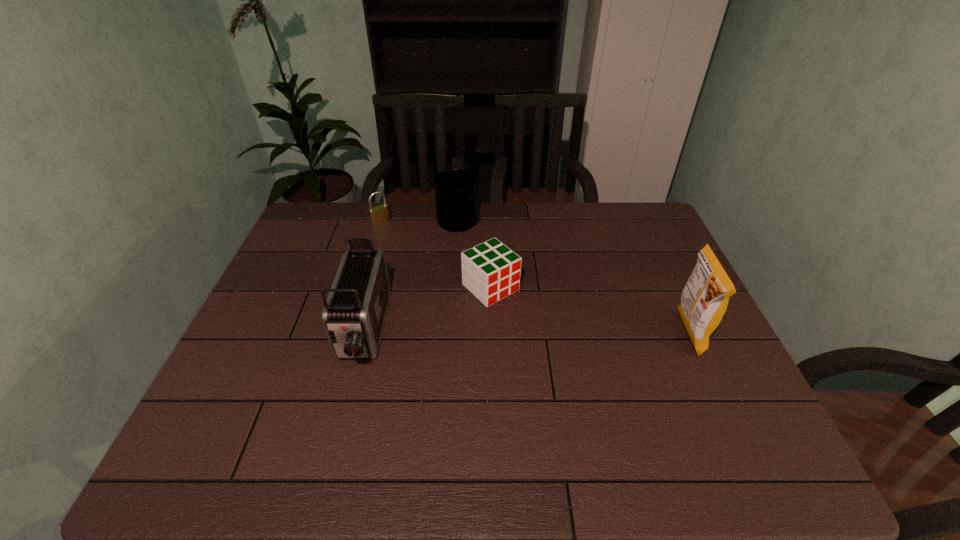
In order to click on vacant space at the left edge in this screenshot , I will do click(282, 340).

In the image, there is a desktop. What are the coordinates of `vacant space at the right edge` in the screenshot? It's located at (660, 256).

In the image, there is a desktop. In order to click on free space at the far right corner in this screenshot , I will do `click(647, 242)`.

I want to click on free area in between the camcorder and the rightmost object, so click(x=525, y=332).

The width and height of the screenshot is (960, 540). In order to click on blank region between the rightmost object and the camcorder in this screenshot , I will do [525, 332].

At what (x,y) coordinates should I click in order to perform the action: click on vacant point located between the cube and the camcorder. Please return your answer as a coordinate pair (x, y). Image resolution: width=960 pixels, height=540 pixels. Looking at the image, I should click on (427, 309).

This screenshot has width=960, height=540. What are the coordinates of `free spot between the padlock and the crisp (potato chip)` in the screenshot? It's located at (535, 278).

Where is `free space between the padlock and the third tallest object`? Image resolution: width=960 pixels, height=540 pixels. free space between the padlock and the third tallest object is located at coordinates (419, 223).

The width and height of the screenshot is (960, 540). I want to click on empty location between the cube and the padlock, so [x=436, y=254].

Find the location of a particular element. Image resolution: width=960 pixels, height=540 pixels. free space between the third shortest object and the camcorder is located at coordinates (410, 277).